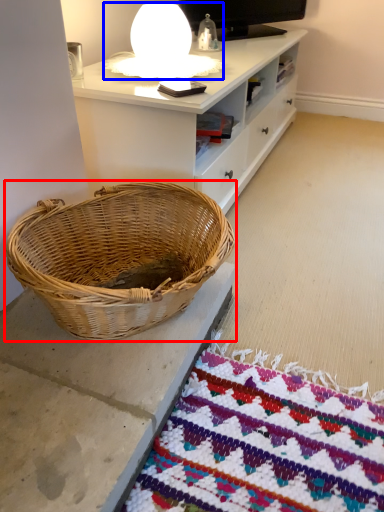
Question: Which point is closer to the camera, picnic basket (highlighted by a red box) or table lamp (highlighted by a blue box)?

Choices:
 (A) picnic basket
 (B) table lamp

Answer: (A)